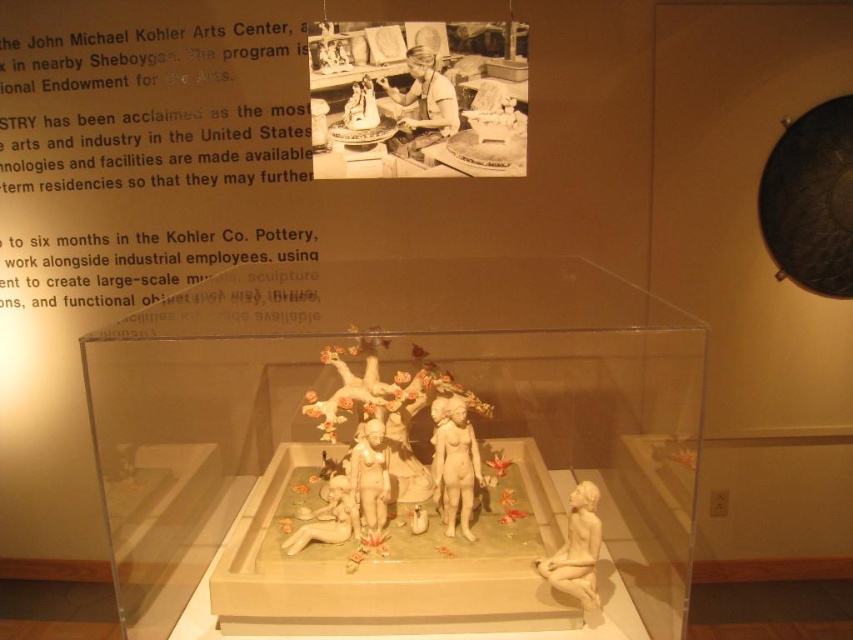
You are an art curator planning to move the matte white statue at center and the porcelain cherub at center to a new gallery layout. The new space has limited floor area. Which object should you prioritize moving first to save space?

The matte white statue at center occupies less space than the porcelain cherub at center, so you should move the porcelain cherub at center first to save more space.

You are a visitor at the John Michael Kohler Arts Center and are looking at the exhibit. You notice two statues in the glass display case. Which statue is closer to you, the matte white statue at center or the white porcelain statue at center?

The matte white statue at center is closer to you because it is further to the viewer than the white porcelain statue at center.

You are an art conservator tasked with moving the matte white statue at center and the white porcelain statue at center to a new display case. The new case has a minimum required distance of 6 inches between any two artifacts for preservation purposes. Based on the current spacing between them, will they need to be moved further apart?

The matte white statue at center and the white porcelain statue at center are currently 5.80 inches apart, which is less than the required 6 inches. Therefore, they need to be moved further apart to meet the preservation standards.